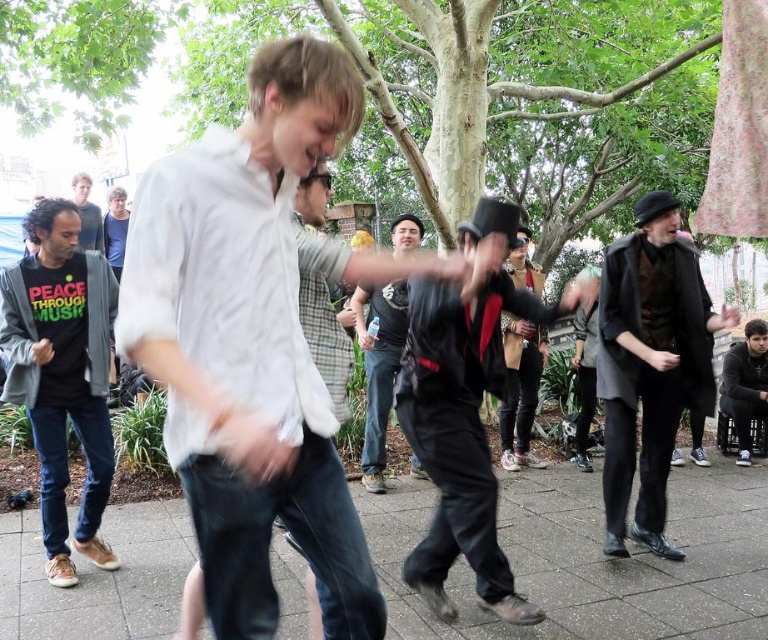
You are standing at the origin point in the image. Which of the two points, point (512, 362) or point (96, 236), is closer to you?

Point (512, 362) is closer to you because it is in front of point (96, 236).

You are a photographer trying to capture a clear photo of the white cotton shirt at center and the dark gray hoodie at lower right. Since the scene is crowded, you need to adjust your camera angle to ensure both are visible. Which object should you focus on first to make sure both are in frame?

The white cotton shirt at center is in front of the dark gray hoodie at lower right, so you should focus on the white cotton shirt at center first to ensure it doesn not block the view of the dark gray hoodie at lower right.